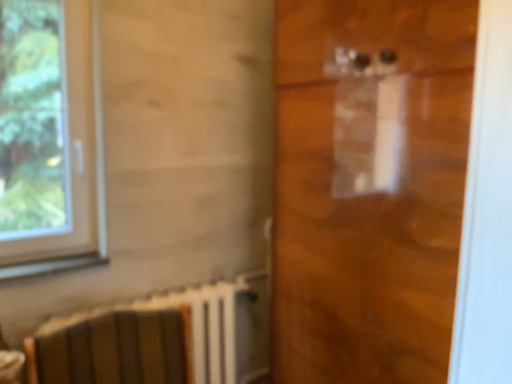
Question: Considering the relative sizes of matte brown table at lower left and transparent plastic door at center in the image provided, is matte brown table at lower left bigger than transparent plastic door at center?

Choices:
 (A) no
 (B) yes

Answer: (A)

Question: Considering the relative sizes of matte brown table at lower left and transparent plastic door at center in the image provided, is matte brown table at lower left wider than transparent plastic door at center?

Choices:
 (A) no
 (B) yes

Answer: (A)

Question: Does matte brown table at lower left turn towards transparent plastic door at center?

Choices:
 (A) yes
 (B) no

Answer: (B)

Question: From a real-world perspective, is matte brown table at lower left located higher than transparent plastic door at center?

Choices:
 (A) yes
 (B) no

Answer: (B)

Question: From the image's perspective, is matte brown table at lower left over transparent plastic door at center?

Choices:
 (A) yes
 (B) no

Answer: (B)

Question: Can you confirm if matte brown table at lower left is thinner than transparent plastic door at center?

Choices:
 (A) no
 (B) yes

Answer: (B)

Question: Does wooden armchair at lower left come in front of white plastic window at left?

Choices:
 (A) yes
 (B) no

Answer: (A)

Question: Does wooden armchair at lower left have a greater height compared to white plastic window at left?

Choices:
 (A) yes
 (B) no

Answer: (B)

Question: Does wooden armchair at lower left have a greater width compared to white plastic window at left?

Choices:
 (A) no
 (B) yes

Answer: (B)

Question: Is wooden armchair at lower left touching white plastic window at left?

Choices:
 (A) no
 (B) yes

Answer: (A)

Question: Does wooden armchair at lower left appear on the right side of white plastic window at left?

Choices:
 (A) yes
 (B) no

Answer: (A)

Question: Can you confirm if wooden armchair at lower left is shorter than white plastic window at left?

Choices:
 (A) no
 (B) yes

Answer: (B)

Question: From a real-world perspective, is matte brown table at lower left located higher than wooden armchair at lower left?

Choices:
 (A) no
 (B) yes

Answer: (B)